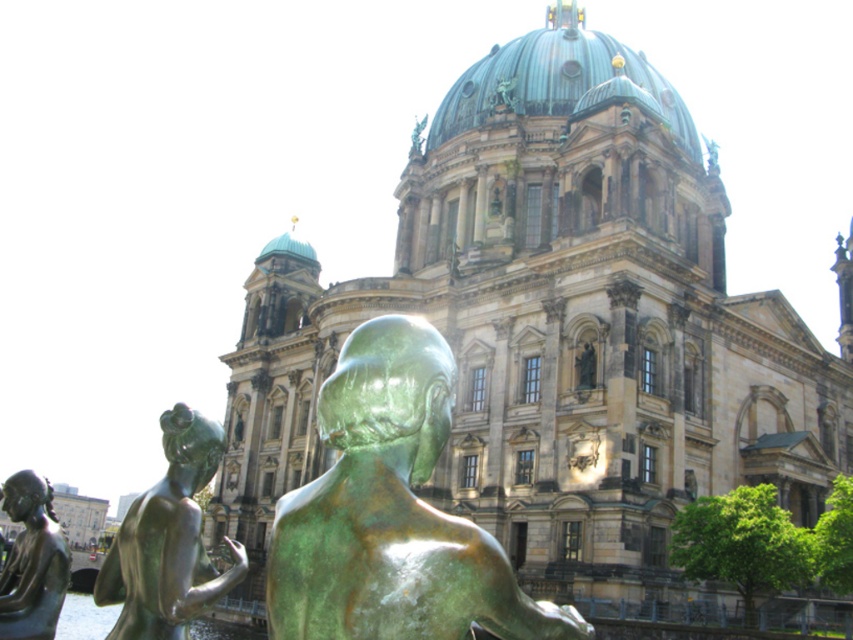
You are standing in front of the cathedral with a green patina statue at center. You want to take a photo of the statue without including the cathedral in the background. Since your camera has a limited field of view, you can only focus on objects within 25 meters. Can you capture the statue in your photo without the cathedral appearing behind it?

The green patina statue at center is 27.17 meters away from the viewer, which is beyond the camera lens limit of 25 meters. Therefore, the statue will not be in focus, and the cathedral behind it might still be visible in the background. To ensure the cathedral is excluded, you need to move closer to reduce the distance to the statue below 25 meters.

You are a tourist standing at the edge of the canal in front of the cathedral. You see the green patina statue at center and the bronze statue at lower left. Which statue is closer to you?

The green patina statue at center is closer to you because it is in front of the bronze statue at lower left.

You are an art student observing the cathedral and its surroundings. You notice two bronze statues near the canal. Which statue is taller between the bronze statue at lower left and the bronze statue at left?

The bronze statue at lower left is taller than the bronze statue at left.